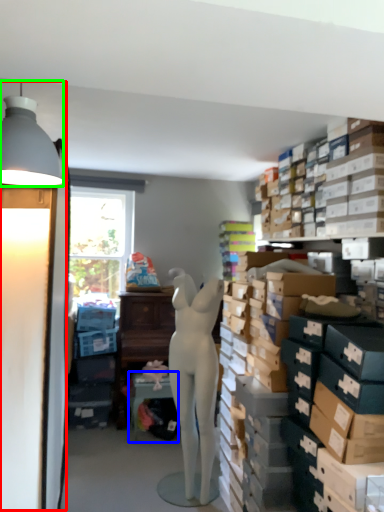
Question: Which object is the closest to the table lamp (highlighted by a red box)? Choose among these: table (highlighted by a blue box) or lamp (highlighted by a green box).

Choices:
 (A) table
 (B) lamp

Answer: (B)